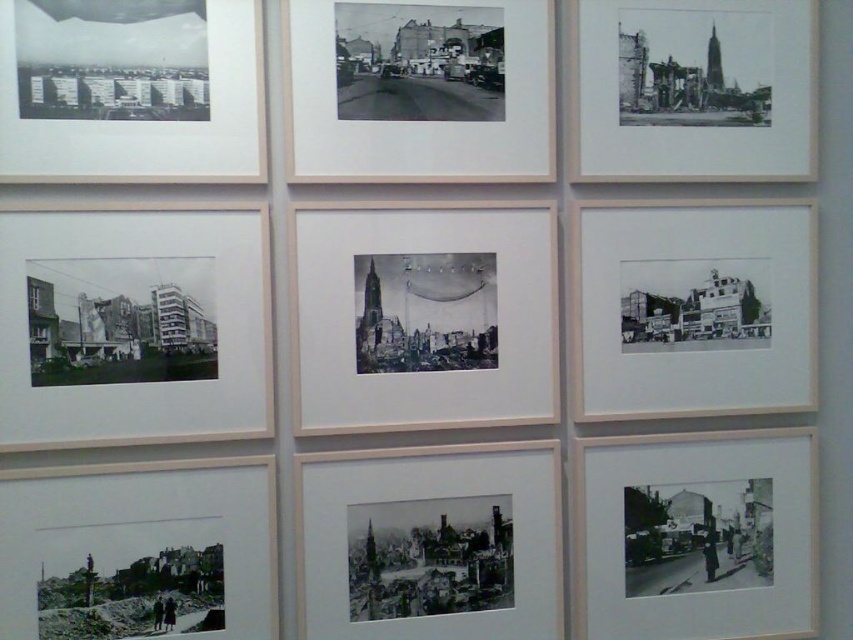
Which is below, grayscale paper cityscape at center or black paper photograph at lower left?

grayscale paper cityscape at center

Is grayscale paper cityscape at center shorter than black paper photograph at lower left?

Incorrect, grayscale paper cityscape at center's height does not fall short of black paper photograph at lower left's.

Is point (393, 634) positioned behind point (248, 492)?

Yes, point (393, 634) is farther from viewer.

Locate an element on the screen. The image size is (853, 640). grayscale paper cityscape at center is located at coordinates (430, 541).

Which of these two, black paper photograph at lower left or black and white photograph at center, stands shorter?

black paper photograph at lower left

Who is more distant from viewer, (229, 547) or (540, 12)?

The point (540, 12) is more distant.

Which is behind, point (16, 474) or point (283, 4)?

The point (283, 4) is behind.

Where is `black paper photograph at lower left`? The width and height of the screenshot is (853, 640). black paper photograph at lower left is located at coordinates (138, 552).

Can you confirm if black and white photograph at center right is bigger than black and white photograph at center?

Yes.

Describe the element at coordinates (697, 308) in the screenshot. I see `black and white photograph at center right` at that location.

Where is `black and white photograph at center right`? black and white photograph at center right is located at coordinates (697, 308).